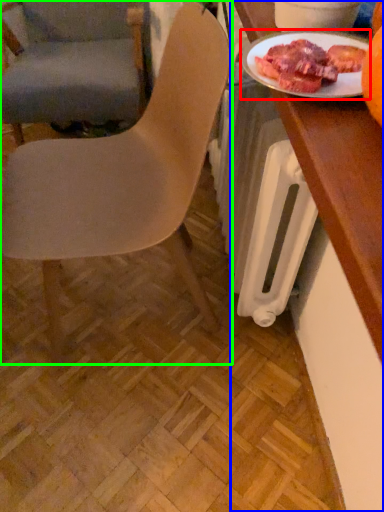
Question: Which object is positioned closest to tableware (highlighted by a red box)? Select from desk (highlighted by a blue box) and chair (highlighted by a green box).

Choices:
 (A) desk
 (B) chair

Answer: (A)